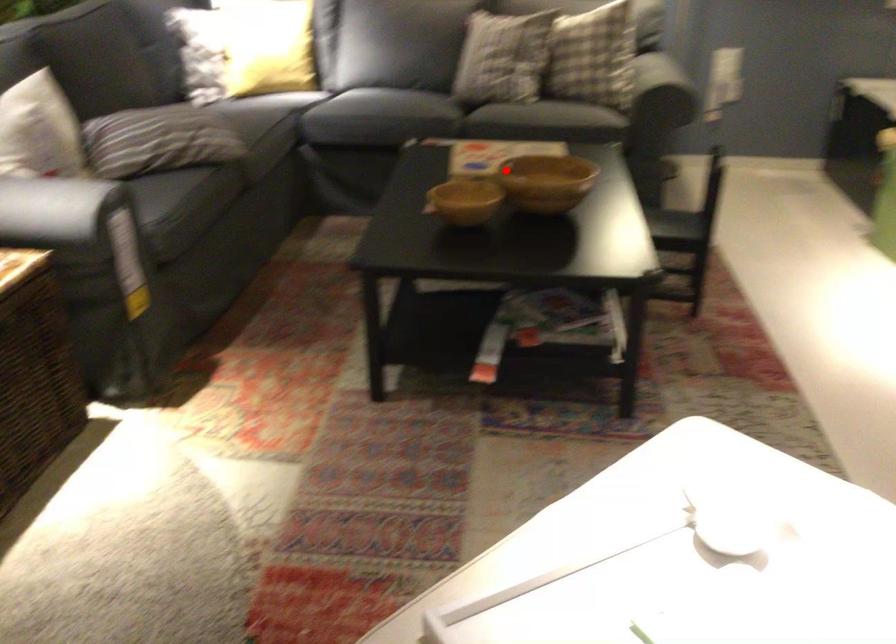
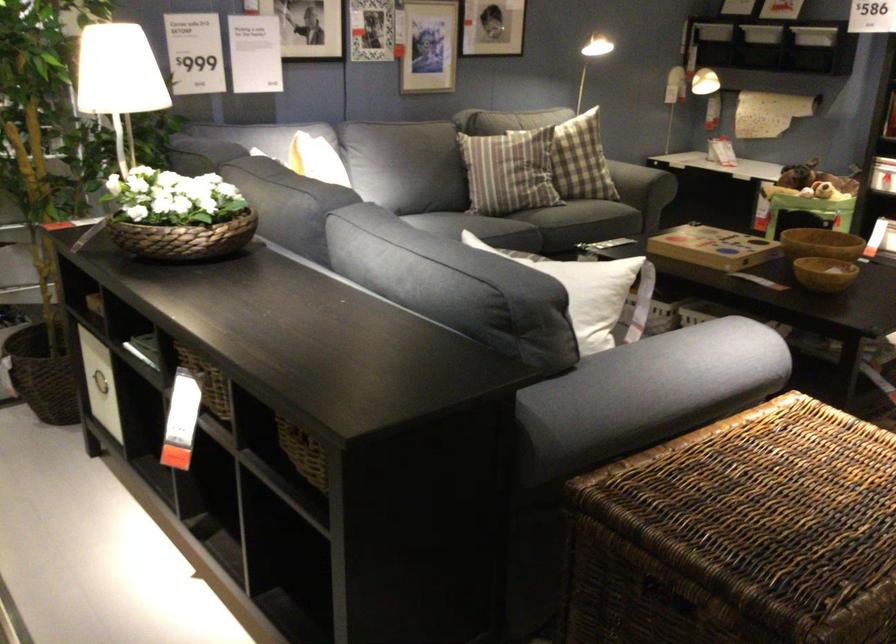
Locate, in the second image, the point that corresponds to the highlighted location in the first image.

(821, 243)